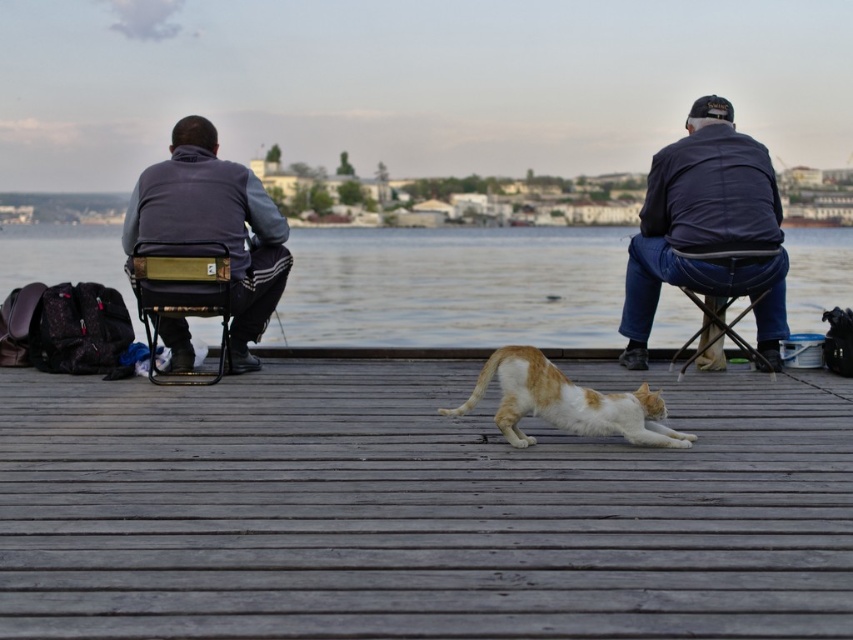
You are a photographer trying to capture a closeup of the metallic gold chair at left without the dark blue denim jacket at upper right blocking the view. Is the jacket too large to avoid blocking the shot?

The dark blue denim jacket at upper right is larger in size than the metallic gold chair at left, so it may block the view of the chair depending on the camera angle and distance. Adjust your position to ensure the jacket doesn

In the scene shown: You are standing on the dock and want to place a small object on the point closer to you. Which point should you choose between point (630, 342) and point (154, 356)?

Point (630, 342) is closer to you, so you should choose that point.

You are a photographer standing on the dock and want to capture a photo of the metallic folding chair at right without the transparent water at center appearing in the shot. What adjustment should you make to your camera angle?

Lower your camera angle so that the metallic folding chair at right is framed below the transparent water at center, which is positioned above it according to the scene description.